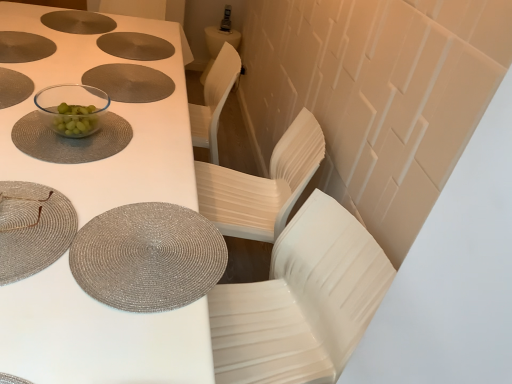
Locate an element on the screen. This screenshot has width=512, height=384. free space in front of matte silver placemat at center is located at coordinates (93, 108).